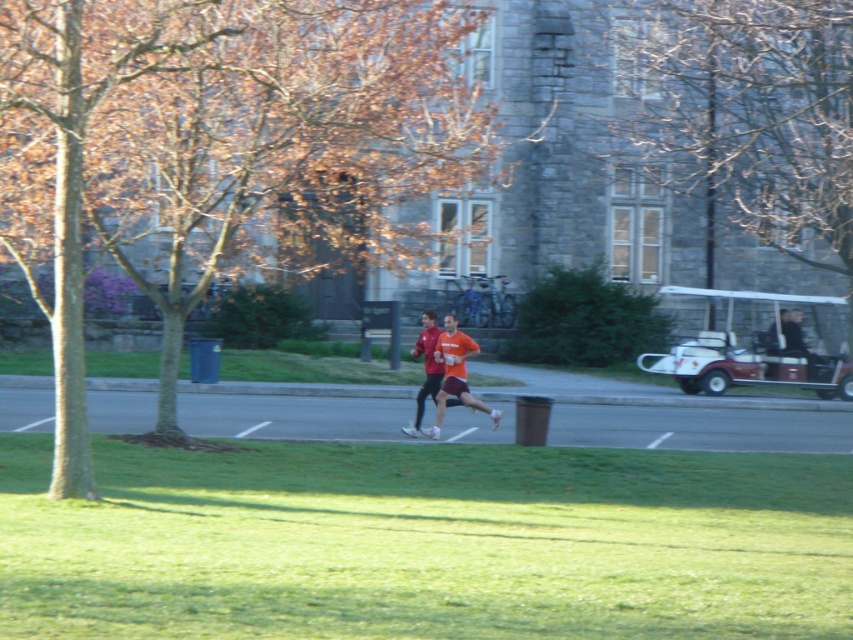
Question: Among these points, which one is farthest from the camera?

Choices:
 (A) (160, 579)
 (B) (717, 26)
 (C) (770, 336)
 (D) (453, 317)

Answer: (B)

Question: Which point is farther to the camera?

Choices:
 (A) (428, 314)
 (B) (287, 42)
 (C) (548, 500)

Answer: (A)

Question: Does green grassy field at lower center have a smaller size compared to bare branches at upper center?

Choices:
 (A) yes
 (B) no

Answer: (A)

Question: Which object appears farthest from the camera in this image?

Choices:
 (A) matte red shirt at center
 (B) orange matte running shirt at center

Answer: (B)

Question: Can you confirm if maroon plastic golf cart at right is bigger than orange matte running shirt at center?

Choices:
 (A) yes
 (B) no

Answer: (B)

Question: In this image, where is green grassy field at lower center located relative to matte red shirt at center?

Choices:
 (A) below
 (B) above

Answer: (A)